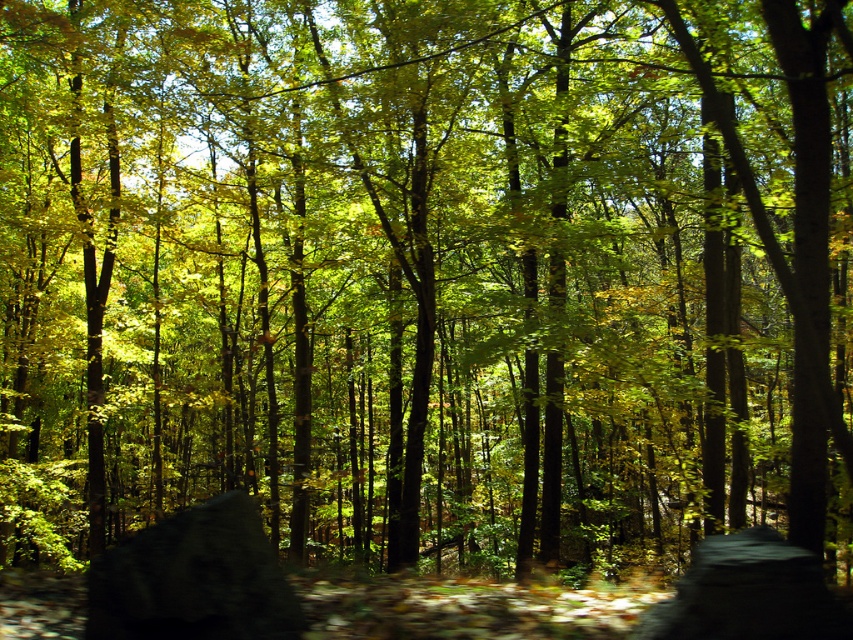
Between point (216, 545) and point (758, 545), which one is positioned behind?

Positioned behind is point (216, 545).

Which is in front, point (268, 564) or point (743, 605)?

Point (743, 605)

Who is more forward, (258, 593) or (821, 636)?

Point (821, 636) is more forward.

Where is `dark gray rock at lower center`? This screenshot has width=853, height=640. dark gray rock at lower center is located at coordinates (193, 579).